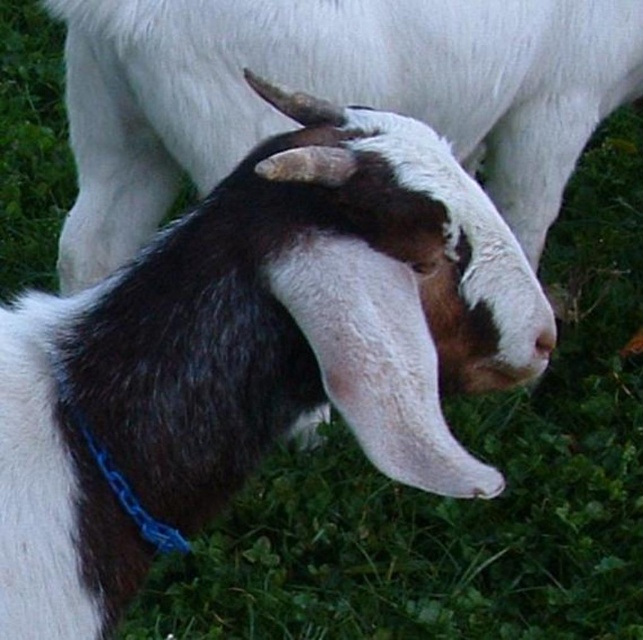
Question: Can you confirm if blue fabric neckband at center is positioned to the right of brown matte/goat nose at center?

Choices:
 (A) yes
 (B) no

Answer: (B)

Question: Is blue fabric neckband at center further to camera compared to brown matte/goat nose at center?

Choices:
 (A) yes
 (B) no

Answer: (B)

Question: Is blue fabric neckband at center positioned at the back of brown matte/goat nose at center?

Choices:
 (A) yes
 (B) no

Answer: (B)